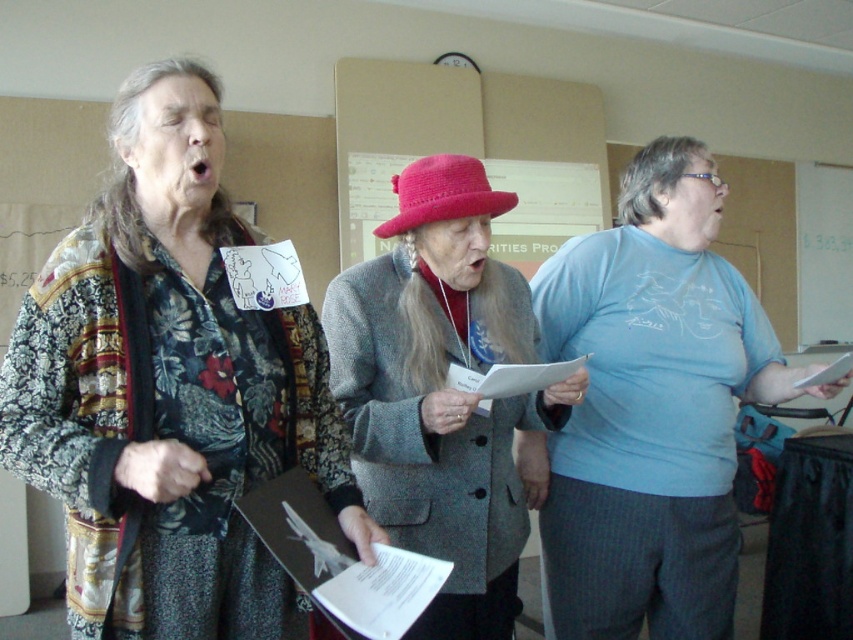
Does gray wool coat at center have a lesser height compared to pink woolen hat at center?

Incorrect, gray wool coat at center's height does not fall short of pink woolen hat at center's.

This screenshot has width=853, height=640. What are the coordinates of `gray wool coat at center` in the screenshot? It's located at (440, 390).

Which of these two, floral fabric shirt at left or pink woolen hat at center, stands taller?

Standing taller between the two is floral fabric shirt at left.

Identify the location of floral fabric shirt at left. The height and width of the screenshot is (640, 853). (167, 390).

Image resolution: width=853 pixels, height=640 pixels. What do you see at coordinates (167, 390) in the screenshot? I see `floral fabric shirt at left` at bounding box center [167, 390].

Identify the location of floral fabric shirt at left. (167, 390).

Between light blue t-shirt at center and pink woolen hat at center, which one has less height?

With less height is pink woolen hat at center.

Does light blue t-shirt at center appear on the left side of pink woolen hat at center?

Incorrect, light blue t-shirt at center is not on the left side of pink woolen hat at center.

Between point (619, 616) and point (463, 160), which one is positioned behind?

Point (619, 616)

The width and height of the screenshot is (853, 640). Find the location of `light blue t-shirt at center`. light blue t-shirt at center is located at coordinates (650, 410).